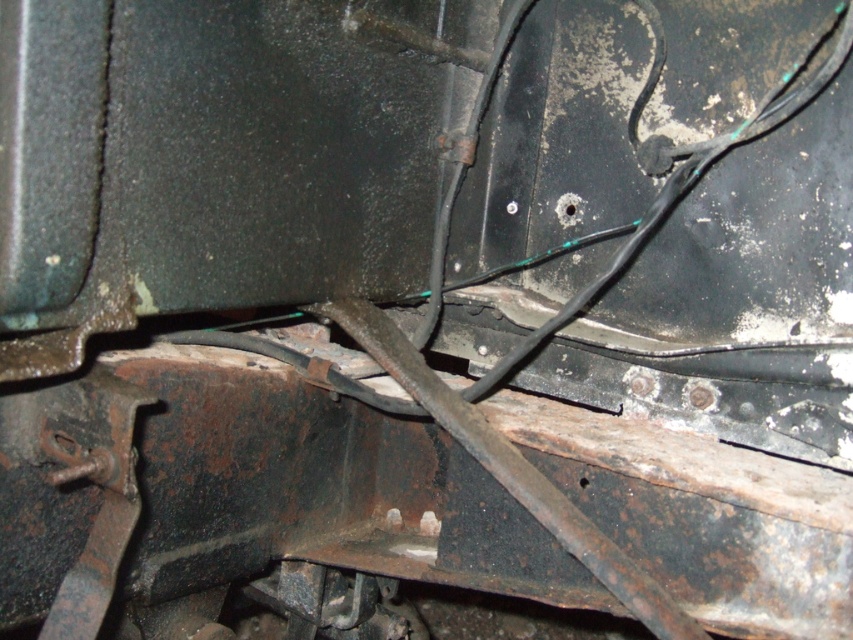
Question: Where is silver metallic bolt at center located in relation to black metal bolt at center in the image?

Choices:
 (A) left
 (B) right

Answer: (A)

Question: Among these points, which one is farthest from the camera?

Choices:
 (A) (572, 212)
 (B) (512, 200)

Answer: (B)

Question: Which point is closer to the camera taking this photo?

Choices:
 (A) (514, 202)
 (B) (567, 205)

Answer: (B)

Question: Does silver metallic bolt at center appear under black metal bolt at center?

Choices:
 (A) yes
 (B) no

Answer: (B)

Question: Which of the following is the closest to the observer?

Choices:
 (A) (566, 212)
 (B) (508, 208)

Answer: (A)

Question: Can you confirm if silver metallic bolt at center is bigger than black metal bolt at center?

Choices:
 (A) yes
 (B) no

Answer: (A)